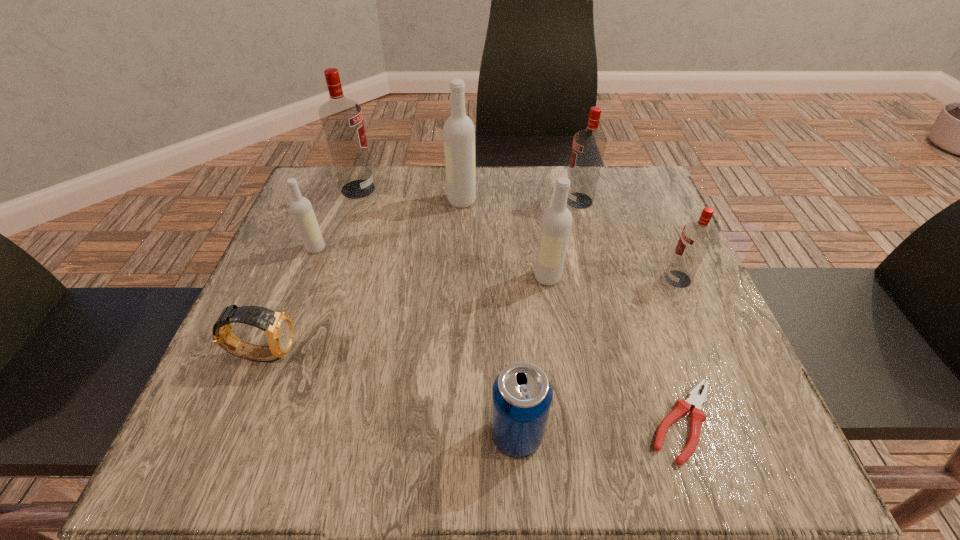
Where is `vacant point located on the front label of the second red vodka from left to right`? vacant point located on the front label of the second red vodka from left to right is located at coordinates (512, 200).

Where is `free space located 0.250m on the right of the second smallest white vodka`? The width and height of the screenshot is (960, 540). free space located 0.250m on the right of the second smallest white vodka is located at coordinates (682, 278).

Identify the location of free location located on the front label of the smallest red vodka. (530, 279).

Image resolution: width=960 pixels, height=540 pixels. I want to click on vacant space located on the front label of the smallest red vodka, so click(481, 279).

At what (x,y) coordinates should I click in order to perform the action: click on vacant space located 0.280m on the front label of the smallest red vodka. Please return your answer as a coordinate pair (x, y). This screenshot has width=960, height=540. Looking at the image, I should click on (530, 279).

This screenshot has width=960, height=540. Find the location of `vacant region located on the front of the sixth nearest object`. vacant region located on the front of the sixth nearest object is located at coordinates (298, 296).

This screenshot has width=960, height=540. Find the location of `free location located 0.370m on the left of the seventh tallest object`. free location located 0.370m on the left of the seventh tallest object is located at coordinates (252, 435).

Locate an element on the screen. vacant space located on the face of the seventh farthest object is located at coordinates (481, 353).

Find the location of a particular element. Image resolution: width=960 pixels, height=540 pixels. free location located on the back of the shortest object is located at coordinates (645, 309).

Locate an element on the screen. The image size is (960, 540). pop soda that is at the near edge is located at coordinates (522, 395).